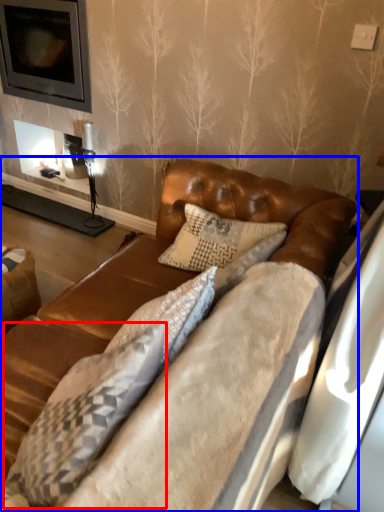
Question: Which point is further to the camera, pillow (highlighted by a red box) or studio couch (highlighted by a blue box)?

Choices:
 (A) pillow
 (B) studio couch

Answer: (A)